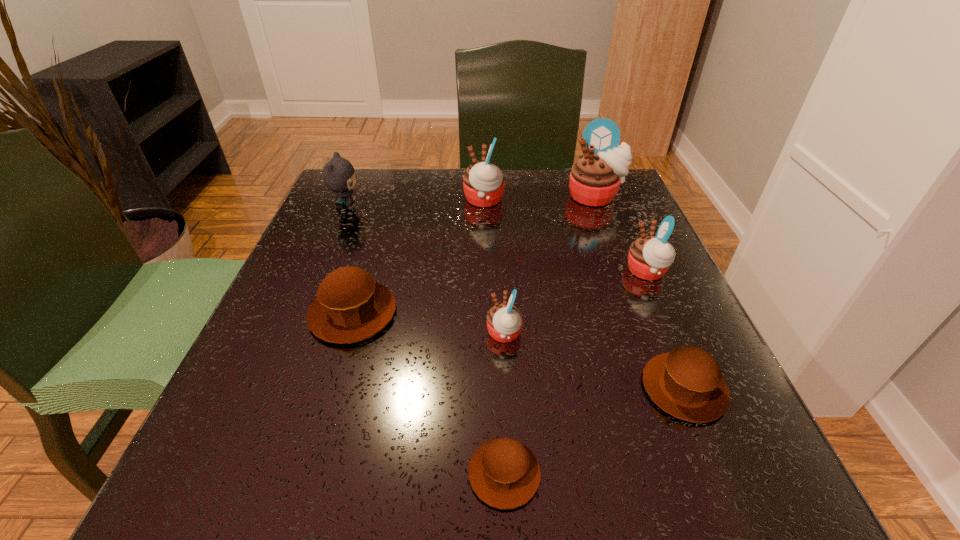
Identify the location of vacant space at the far right corner of the desktop. (561, 174).

Find the location of a particular element. Image resolution: width=960 pixels, height=540 pixels. vacant space that's between the nearest pink muffin and the second smallest pink muffin is located at coordinates (575, 303).

Identify the location of free space between the sixth shortest muffin and the smallest pink muffin. The height and width of the screenshot is (540, 960). (494, 267).

Identify the location of vacant space that's between the biggest brown muffin and the tallest muffin. (x=474, y=255).

The image size is (960, 540). I want to click on vacant region between the sixth shortest muffin and the farthest brown muffin, so click(419, 256).

You are a GUI agent. You are given a task and a screenshot of the screen. Output one action in this format:
    pyautogui.click(x=<x>, y=<y>)
    Task: Click on the free space between the nearest pink muffin and the smallest brown muffin
    Image resolution: width=960 pixels, height=540 pixels.
    Given the screenshot: What is the action you would take?
    pyautogui.click(x=504, y=403)

This screenshot has height=540, width=960. Identify the location of free space between the kitten and the second tallest object. point(415,204).

At what (x,y) coordinates should I click in order to perform the action: click on empty space that is in between the tallest muffin and the second nearest pink muffin. Please return your answer as a coordinate pair (x, y). Image resolution: width=960 pixels, height=540 pixels. Looking at the image, I should click on (621, 234).

Locate an element on the screen. The image size is (960, 540). vacant space that is in between the third smallest pink muffin and the second biggest brown muffin is located at coordinates (584, 294).

Where is `free space that is in between the gray kitten and the farthest brown muffin`? free space that is in between the gray kitten and the farthest brown muffin is located at coordinates tap(349, 260).